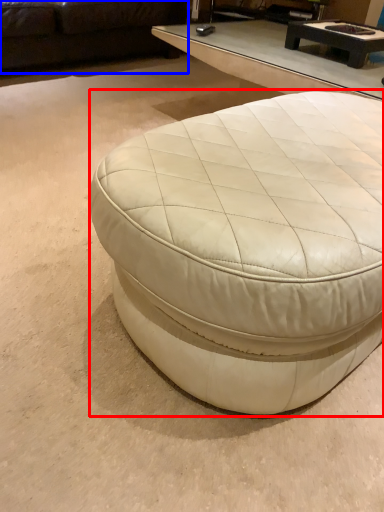
Question: Among these objects, which one is farthest to the camera, coffee table (highlighted by a red box) or studio couch (highlighted by a blue box)?

Choices:
 (A) coffee table
 (B) studio couch

Answer: (B)